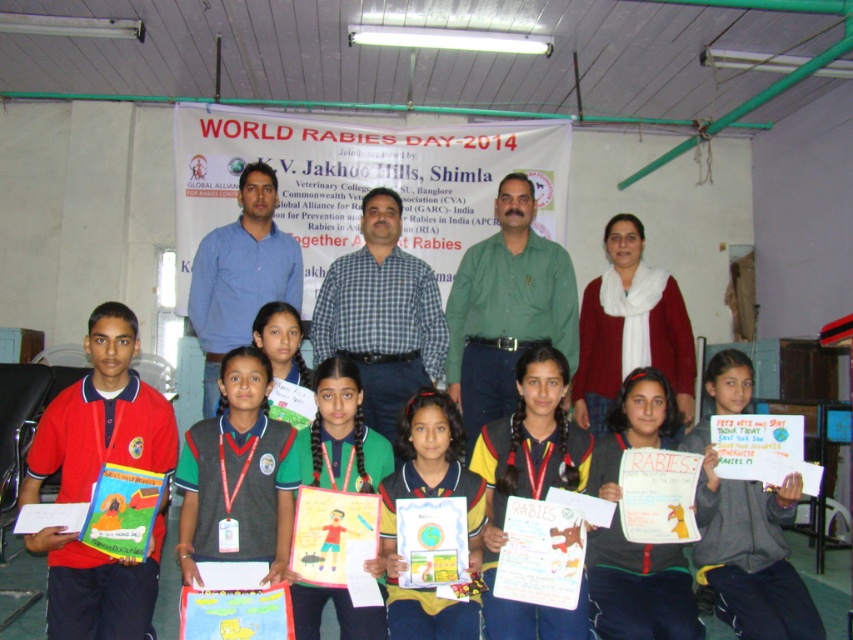
You are a photographer at the event and want to capture both the yellow uniform at center and the green fabric uniform at center in a single photo. Which uniform should you focus on first to ensure both are in frame?

The yellow uniform at center is located below the green fabric uniform at center. To capture both in a single photo, focus on the green fabric uniform at center first, as it is higher up, allowing the yellow uniform at center to naturally fall into the lower part of the frame.